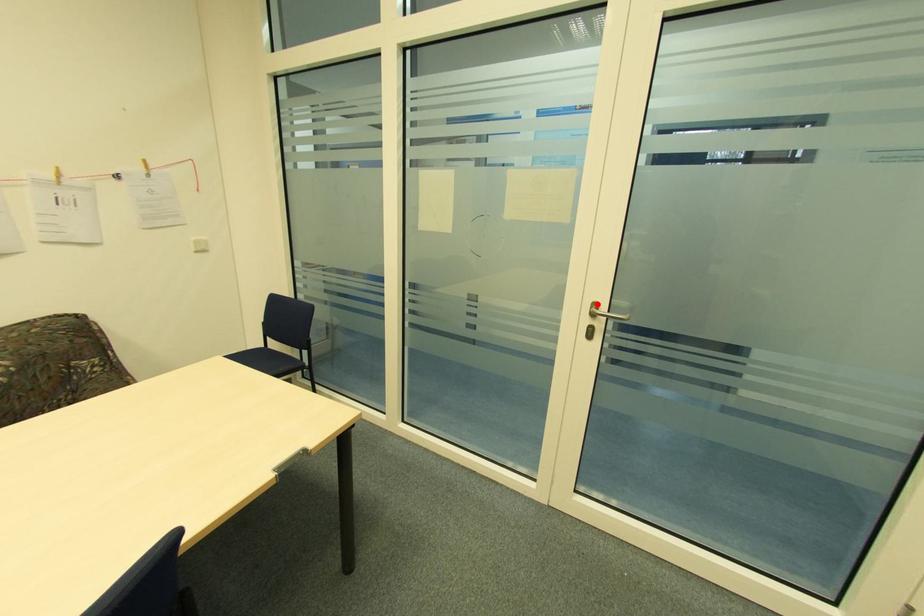
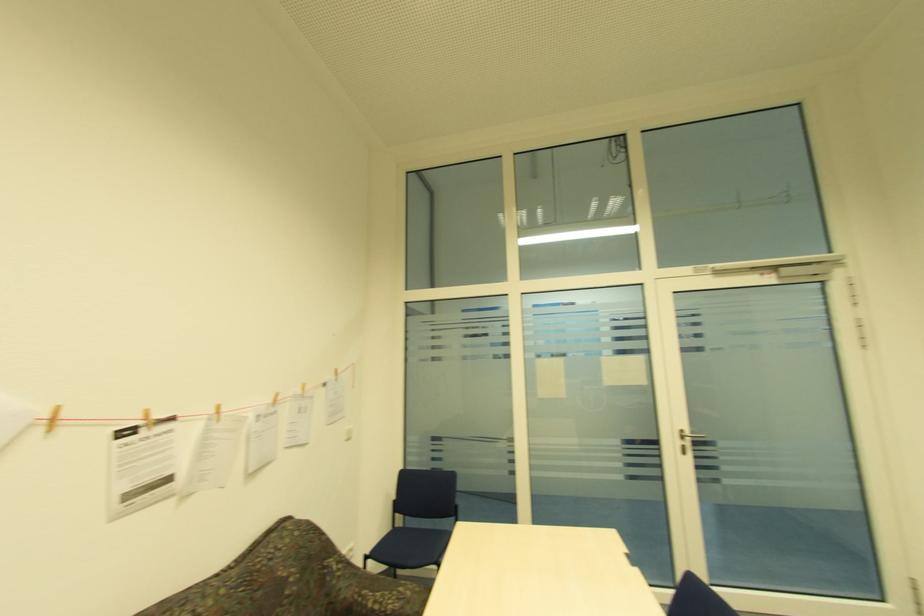
Where in the second image is the point corresponding to the highlighted location from the first image?

(685, 432)